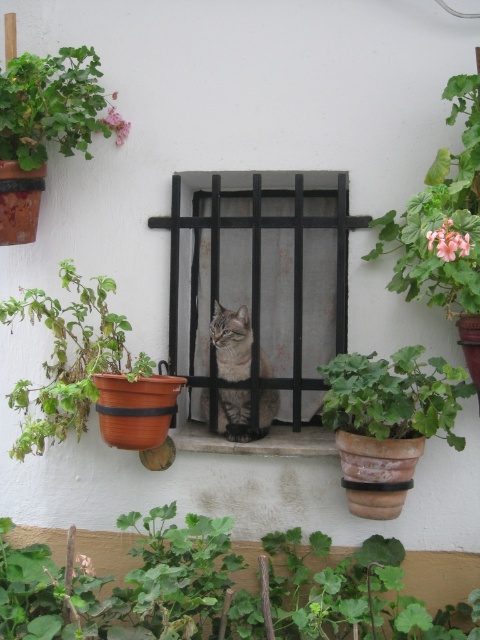
Question: Does green leafy plant at upper right appear on the left side of terracotta clay pot at upper left?

Choices:
 (A) no
 (B) yes

Answer: (A)

Question: Which is farther from the green matte pot at right?

Choices:
 (A) green matte pot at left
 (B) terracotta clay pot at upper left
 (C) green leafy plant at lower center

Answer: (B)

Question: Which point is farther to the camera?

Choices:
 (A) green leafy plant at upper left
 (B) black metal bars at center

Answer: (B)

Question: Does green leafy plant at upper right appear on the right side of terracotta clay pot at upper left?

Choices:
 (A) no
 (B) yes

Answer: (B)

Question: Which of the following is the farthest from the observer?

Choices:
 (A) green leafy plant at upper left
 (B) green leafy plant at lower center

Answer: (A)

Question: Can you confirm if black metal bars at center is wider than green leafy plant at upper right?

Choices:
 (A) yes
 (B) no

Answer: (A)